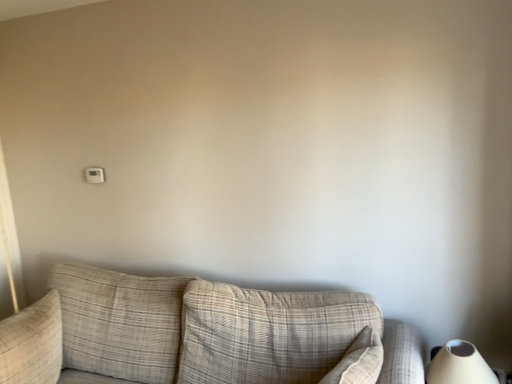
Question: Is beige plaid couch at center facing away from beige textured pillow at left?

Choices:
 (A) no
 (B) yes

Answer: (A)

Question: From a real-world perspective, is beige plaid couch at center beneath beige textured pillow at left?

Choices:
 (A) no
 (B) yes

Answer: (B)

Question: Does beige plaid couch at center come in front of beige textured pillow at left?

Choices:
 (A) no
 (B) yes

Answer: (B)

Question: Is beige plaid couch at center not inside beige textured pillow at left?

Choices:
 (A) yes
 (B) no

Answer: (A)

Question: Is beige textured pillow at left located within beige plaid couch at center?

Choices:
 (A) yes
 (B) no

Answer: (A)

Question: From a real-world perspective, is white matte table lamp at lower right above or below beige textured pillow at left?

Choices:
 (A) above
 (B) below

Answer: (B)

Question: Considering the positions of white matte table lamp at lower right and beige textured pillow at left in the image, is white matte table lamp at lower right bigger or smaller than beige textured pillow at left?

Choices:
 (A) small
 (B) big

Answer: (A)

Question: Considering the relative positions of white matte table lamp at lower right and beige textured pillow at left in the image provided, is white matte table lamp at lower right to the left or to the right of beige textured pillow at left?

Choices:
 (A) left
 (B) right

Answer: (B)

Question: From the image's perspective, relative to beige textured pillow at left, is white matte table lamp at lower right above or below?

Choices:
 (A) above
 (B) below

Answer: (A)

Question: In terms of size, does white plastic thermostat at upper left appear bigger or smaller than beige textured pillow at left?

Choices:
 (A) big
 (B) small

Answer: (B)

Question: From a real-world perspective, is white plastic thermostat at upper left physically located above or below beige textured pillow at left?

Choices:
 (A) above
 (B) below

Answer: (A)

Question: From the image's perspective, is white plastic thermostat at upper left positioned above or below beige textured pillow at left?

Choices:
 (A) below
 (B) above

Answer: (B)

Question: Considering their positions, is white plastic thermostat at upper left located in front of or behind beige textured pillow at left?

Choices:
 (A) behind
 (B) front

Answer: (A)

Question: In terms of height, does beige plaid couch at center look taller or shorter compared to white matte table lamp at lower right?

Choices:
 (A) tall
 (B) short

Answer: (A)

Question: Considering the positions of beige plaid couch at center and white matte table lamp at lower right in the image, is beige plaid couch at center wider or thinner than white matte table lamp at lower right?

Choices:
 (A) wide
 (B) thin

Answer: (A)